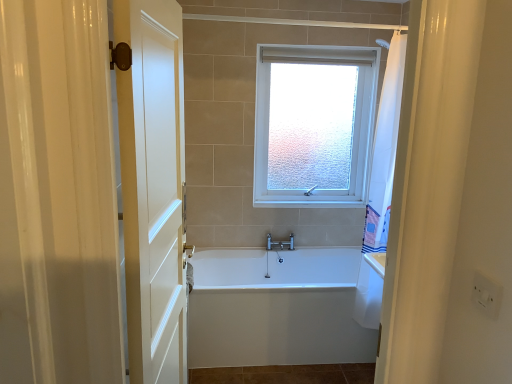
Question: From a real-world perspective, is white glossy bathtub at center physically located above or below frosted glass window at upper center?

Choices:
 (A) above
 (B) below

Answer: (B)

Question: Based on their positions, is white glossy bathtub at center located to the left or right of frosted glass window at upper center?

Choices:
 (A) left
 (B) right

Answer: (A)

Question: Based on their relative distances, which object is nearer to the white glossy bathtub at center?

Choices:
 (A) frosted glass window at upper center
 (B) white wooden door at left

Answer: (B)

Question: Estimate the real-world distances between objects in this image. Which object is farther from the white wooden door at left?

Choices:
 (A) white glossy bathtub at center
 (B) frosted glass window at upper center

Answer: (B)